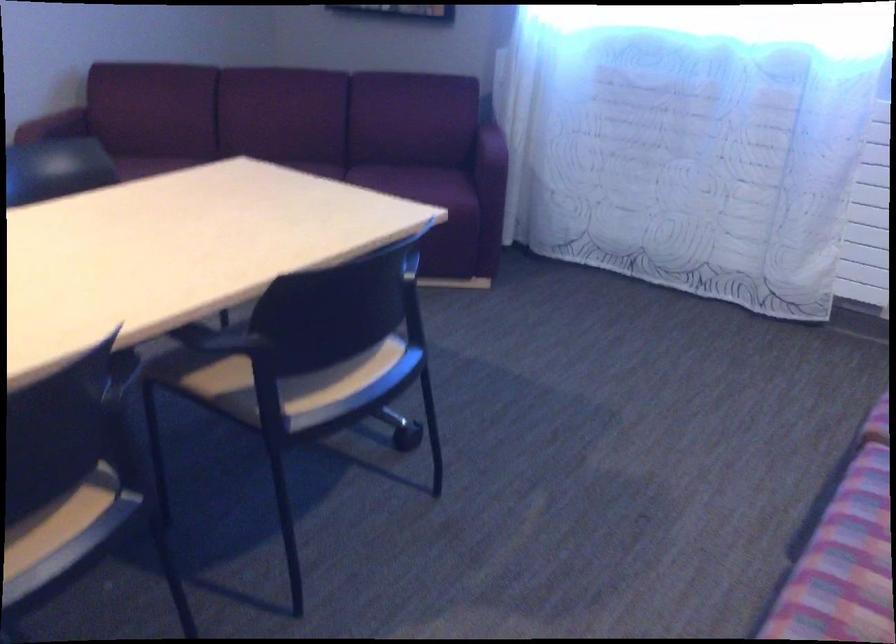
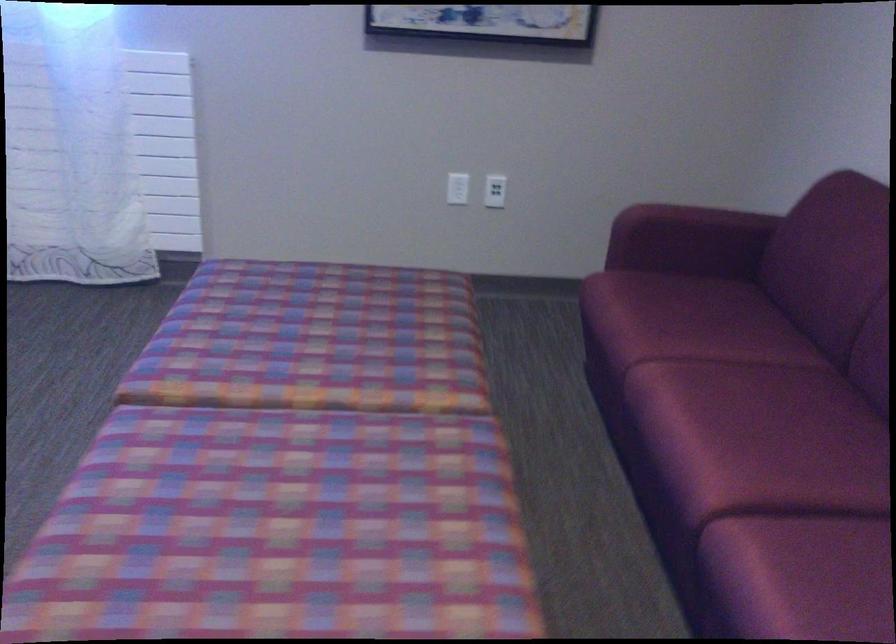
Question: The first image is from the beginning of the video and the second image is from the end. How did the camera likely rotate when shooting the video?

Choices:
 (A) Left
 (B) Right
 (C) Up
 (D) Down

Answer: (B)